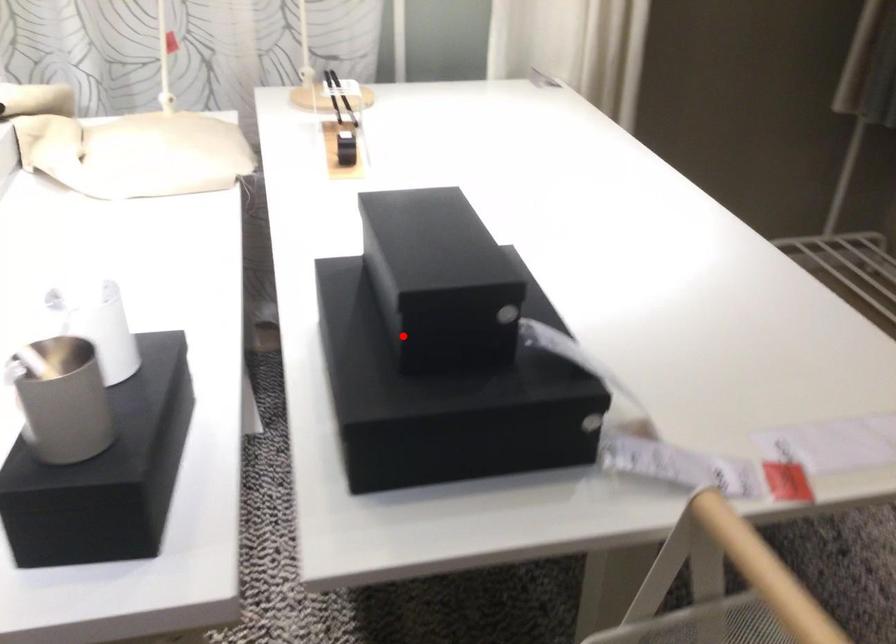
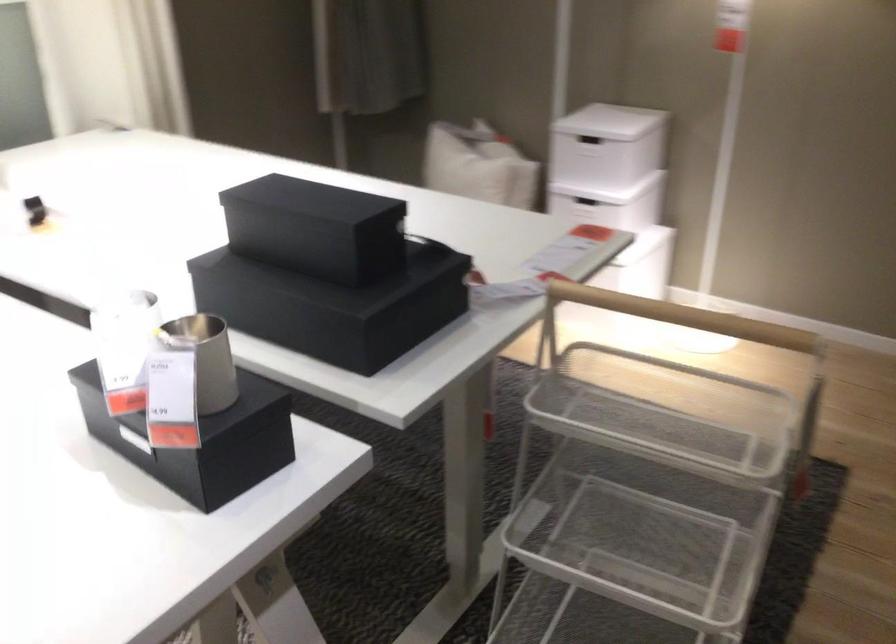
In the second image, find the point that corresponds to the highlighted location in the first image.

(328, 272)